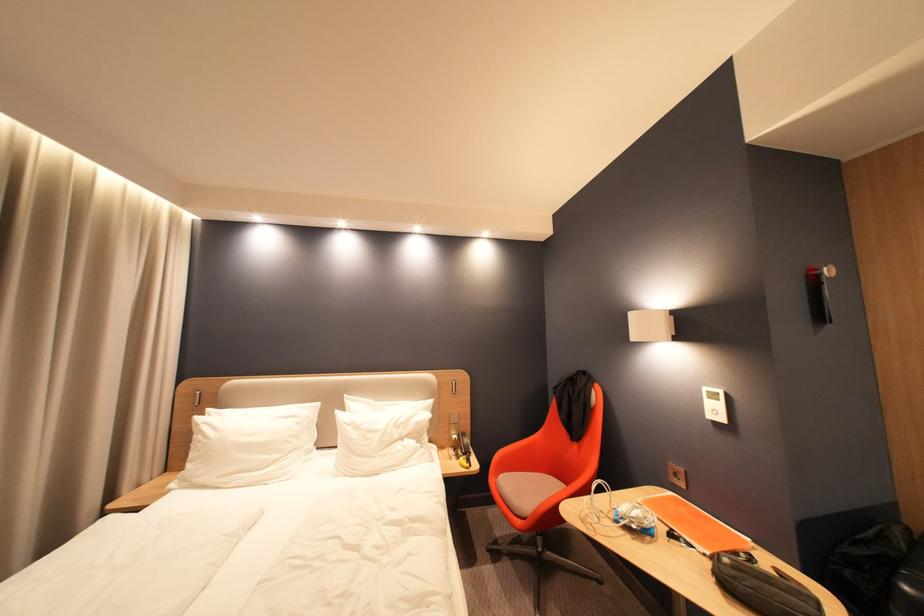
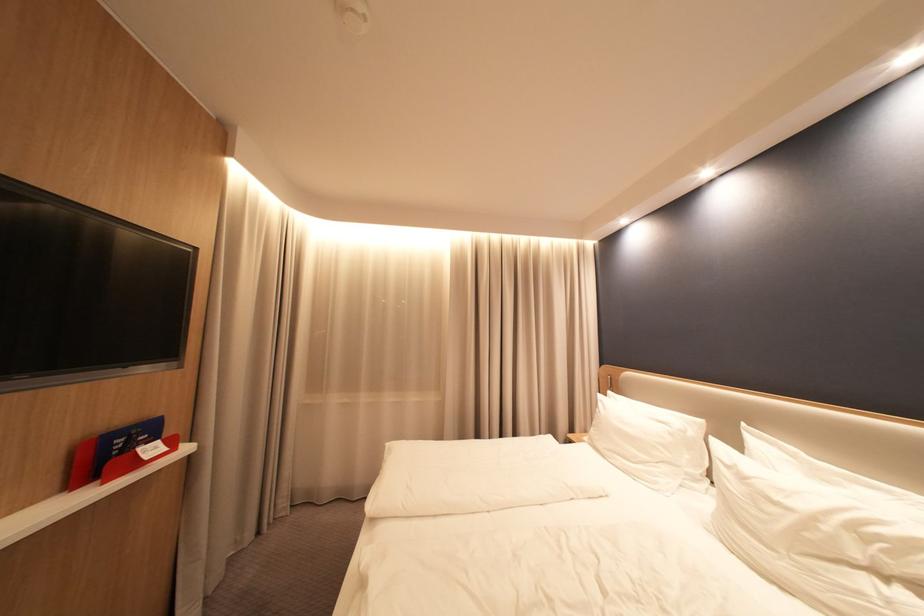
In the second image, find the point that corresponds to the point at 213,416 in the first image.

(615, 397)